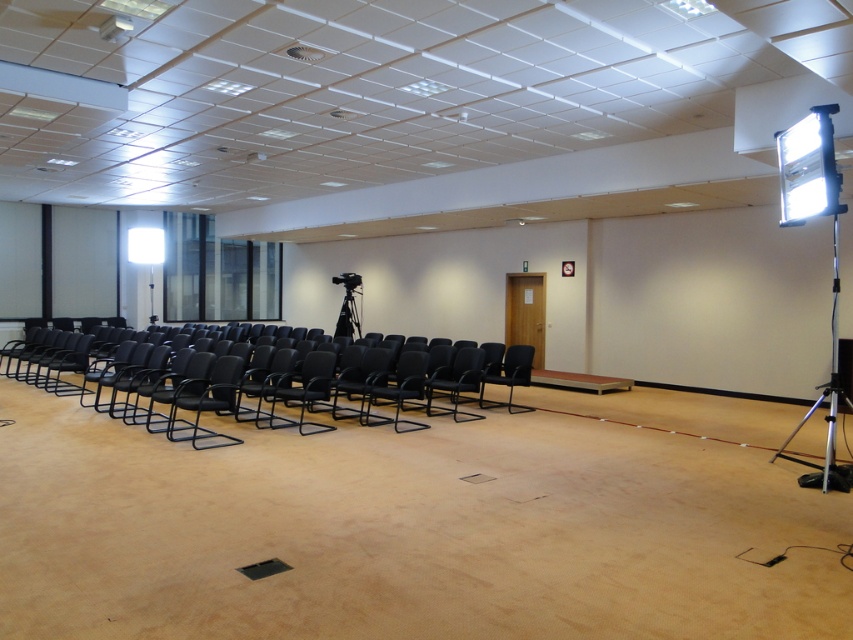
Question: Does white glossy projector at upper right appear on the left side of white plastic projector at upper left?

Choices:
 (A) no
 (B) yes

Answer: (A)

Question: Does black leather chairs at left appear on the left side of black leather chair at center?

Choices:
 (A) no
 (B) yes

Answer: (B)

Question: Which object appears closest to the camera in this image?

Choices:
 (A) black leather chair at center
 (B) black matte tripod at center
 (C) silver metallic tripod at right

Answer: (C)

Question: Estimate the real-world distances between objects in this image. Which object is closer to the black leather chair at center?

Choices:
 (A) white glossy projector at upper right
 (B) white plastic projector at upper left
 (C) white glossy projection screen at upper left
 (D) silver metallic tripod at right

Answer: (D)

Question: Can you confirm if white glossy projector at upper right is positioned to the right of white plastic projector at upper left?

Choices:
 (A) no
 (B) yes

Answer: (B)

Question: Estimate the real-world distances between objects in this image. Which object is farther from the black leather chairs at left?

Choices:
 (A) white plastic projector at upper left
 (B) white glossy projection screen at upper left
 (C) silver metallic tripod at right

Answer: (B)